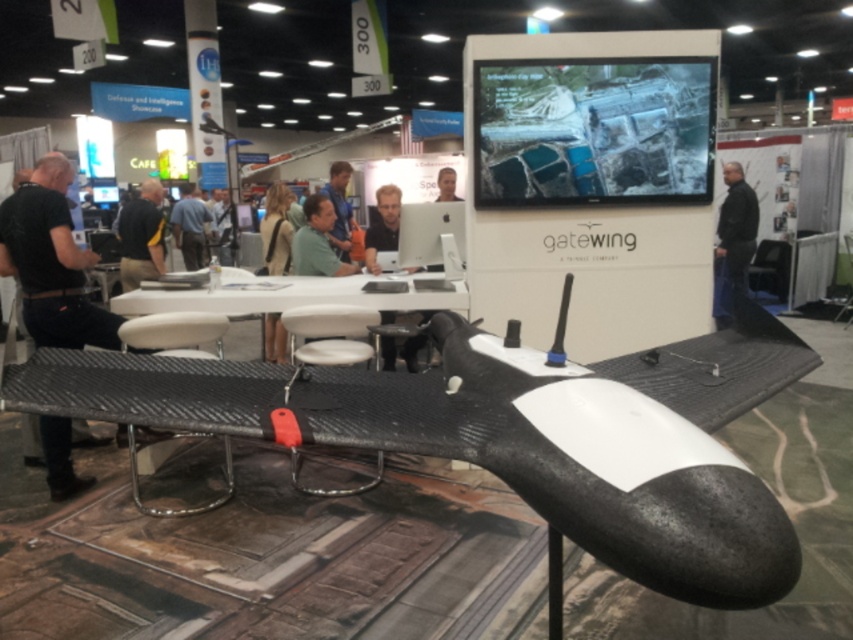
You are a photographer at the exhibition. You want to take a photo of the light brown leather jacket at center and the smooth skin face at center in the same frame. Based on their sizes, which object should you focus on first to ensure both are in focus?

The light brown leather jacket at center might be wider than smooth skin face at center, so you should focus on the wider object first to ensure both are in focus.

You are at a trade show and need to place a new object between the matte black laptop at center and the green matte shirt at center. Which object should be placed closer to the laptop to maintain the existing size order?

Since the matte black laptop at center is narrower than the green matte shirt at center, you should place the new object closer to the laptop to maintain the size order.

From the picture: You are an attendee at the exhibition and you want to place a 12 inch wide notebook between the matte black laptop at center and the green matte shirt at center. Is there enough space?

The distance between the matte black laptop at center and the green matte shirt at center is 32.35 inches, so yes, there is enough space to place a 12 inch wide notebook between them.